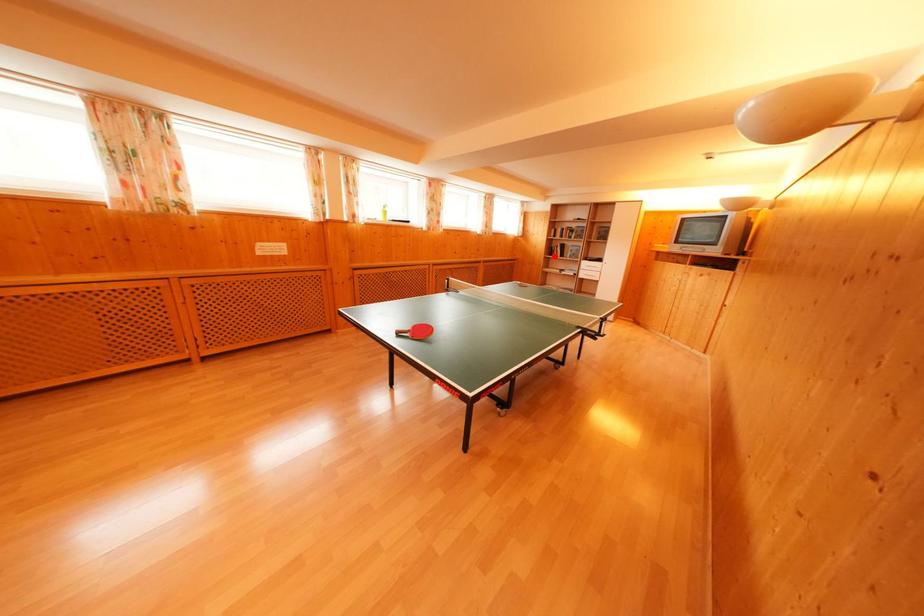
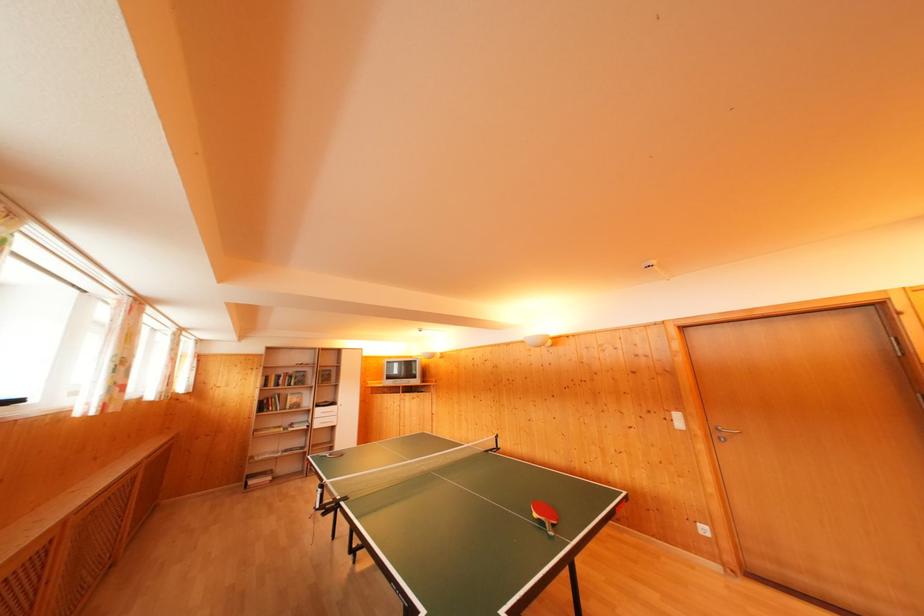
The point at the highlighted location is marked in the first image. Where is the corresponding point in the second image?

(268, 411)